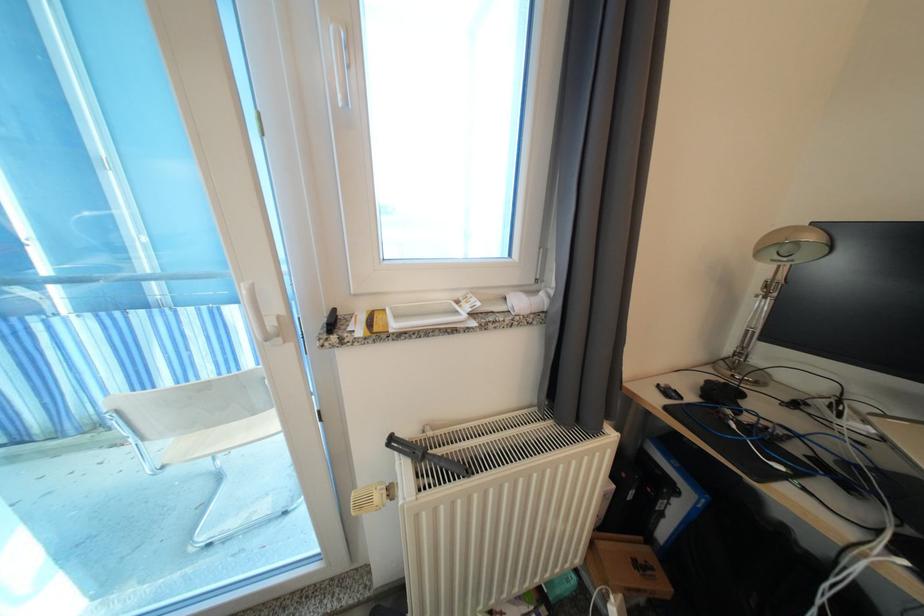
Describe the element at coordinates (257, 315) in the screenshot. I see `the white door handle` at that location.